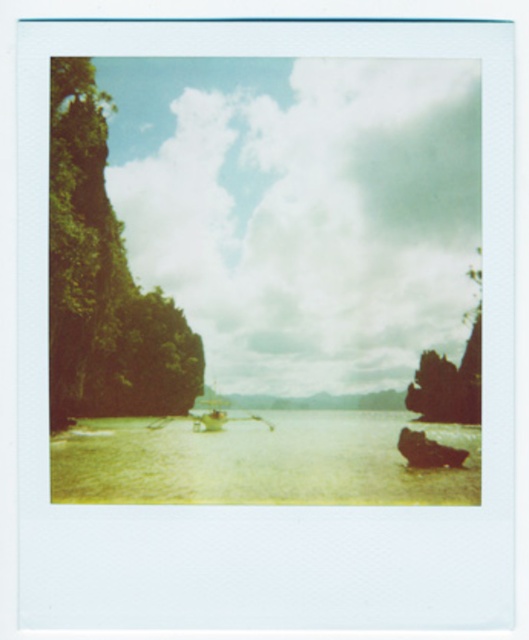
You are standing at the point marked as point [313,416] and want to reach a point that is 372.74 meters away. Is there any object between you and that distant point that might block your path?

The small dark rock formation partially submerged on the right side of the water may block your path as it is located between you and the distant point 372.74 meters away.

You are standing at the center of the image and want to locate the dark brown wooden boat at lower right. Based on the coordinates provided, in which direction should you look to find it?

The dark brown wooden boat at lower right is located at coordinates point (427, 451), so you should look to the lower right direction to find it.

In the scene shown: You are a photographer standing on the shore of the coastal scene. You notice the dark brown rocky cliff at right and the dark brown wooden boat at lower right. Which object is positioned higher in the image?

The dark brown rocky cliff at right is located above the dark brown wooden boat at lower right, so it is positioned higher in the image.